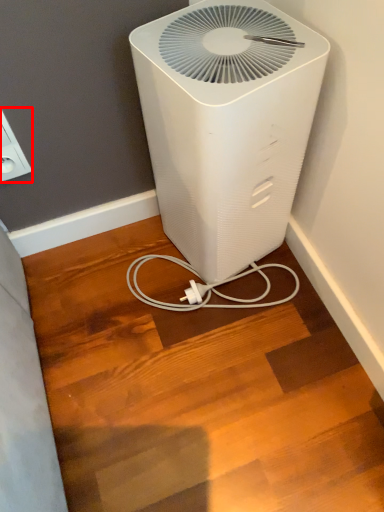
Question: From the image's perspective, considering the relative positions of electric outlet (annotated by the red box) and home appliance in the image provided, where is electric outlet (annotated by the red box) located with respect to the staircase?

Choices:
 (A) above
 (B) below

Answer: (A)